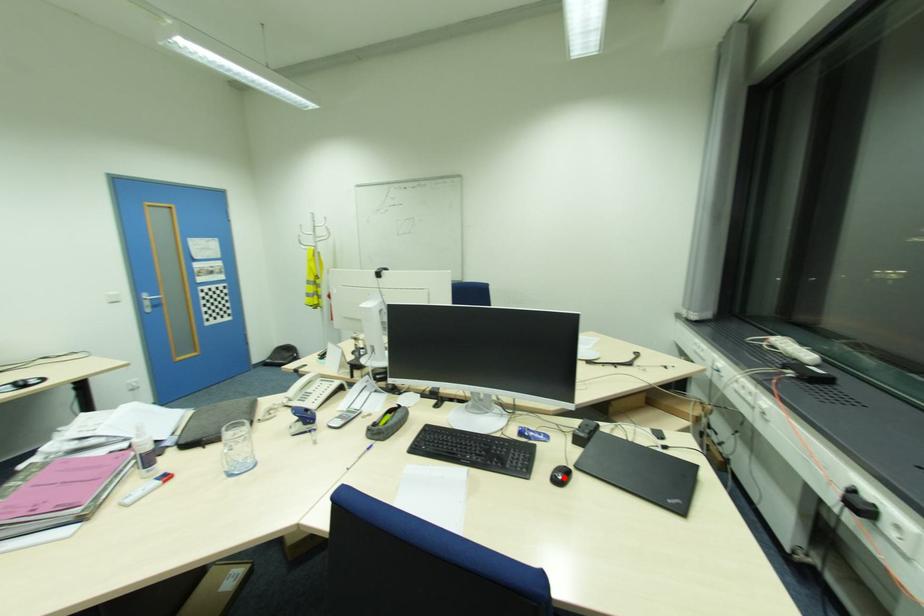
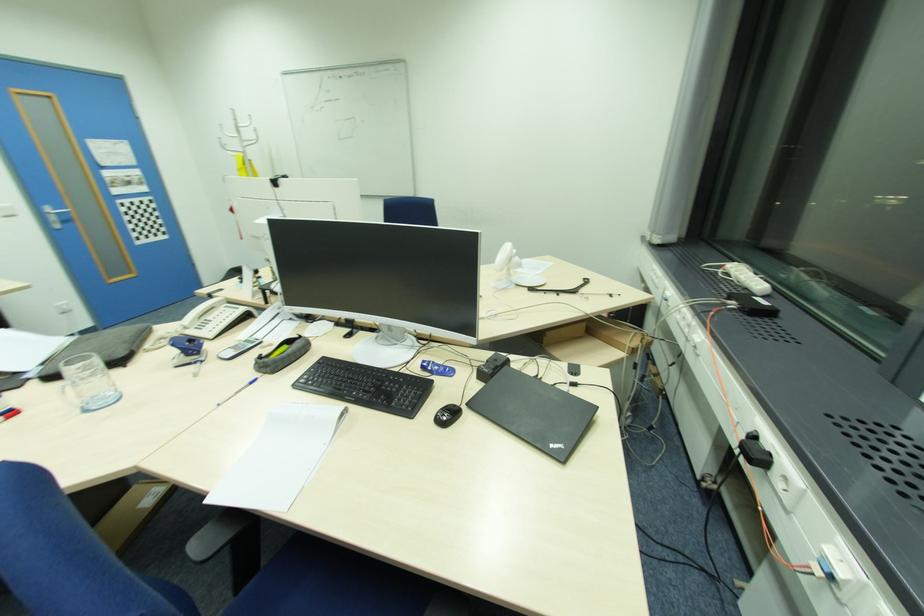
The point at the highlighted location is marked in the first image. Where is the corresponding point in the second image?

(447, 418)